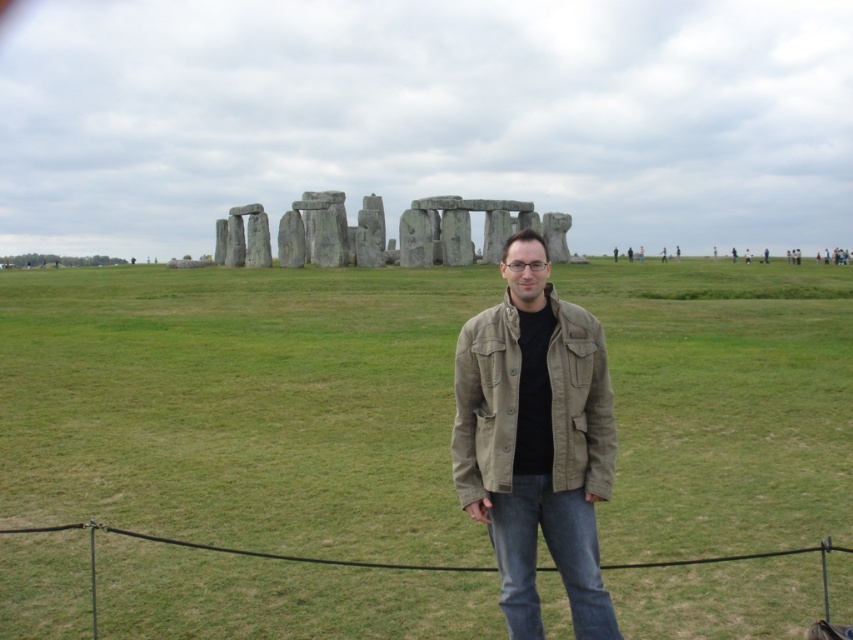
You are a photographer planning to capture a wide shot of Stonehenge. You have a camera that requires a clear path between the green grassy field at center and the khaki cotton jacket at center. Is the path between them clear?

The green grassy field at center is positioned on the left side of khaki cotton jacket at center, so there is a clear path between them for the camera.

You are standing at the point marked as point [241,404] in the image of Stonehenge. Looking around, you see the green grassy field at center. What is directly beneath your feet?

The point [241,404] is on the green grassy field at center, so the ground beneath your feet is the green grassy field at center.

You are a photographer trying to capture a photo of the khaki cotton jacket at center and the green grassy field at center. Which object is positioned higher in the frame?

The green grassy field at center is above the khaki cotton jacket at center, so it is positioned higher in the frame.